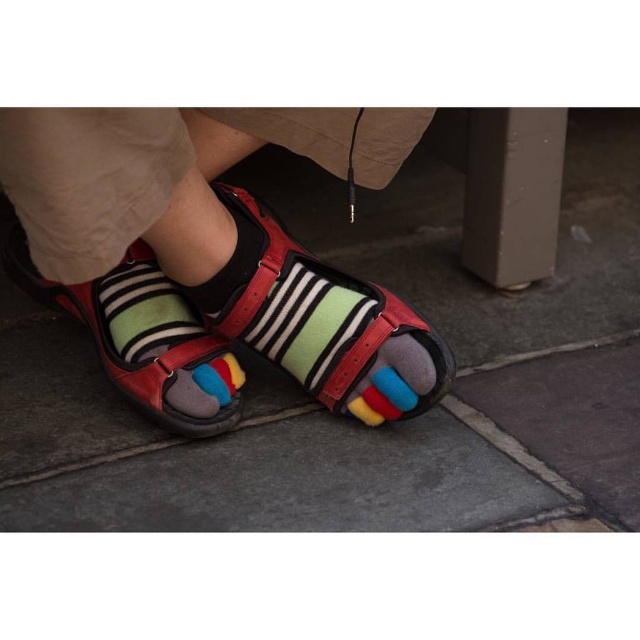
You are trying to locate a specific point in the image. The point is at coordinates (321, 323). Based on the scene description, where is this point located?

The point at coordinates (321, 323) is located on the leather sandal at center.

Based on the photo, you are looking at the image of the person wearing colorful socks and sandals. There are two points marked in the image. Which point, point (x=356, y=358) or point (x=115, y=328), is closer to you?

Point (x=356, y=358) is closer to the viewer than point (x=115, y=328).